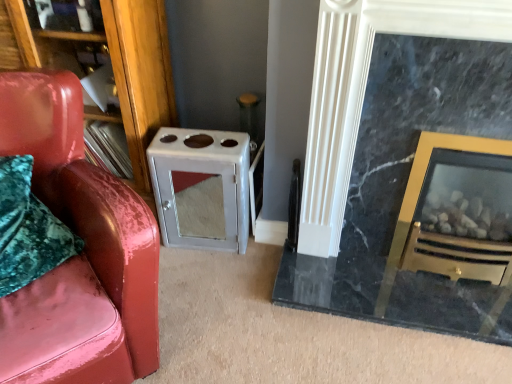
Question: Can you confirm if satin silver cabinet at center is positioned to the right of glossy leather chair at left?

Choices:
 (A) no
 (B) yes

Answer: (B)

Question: Does satin silver cabinet at center appear on the left side of glossy leather chair at left?

Choices:
 (A) yes
 (B) no

Answer: (B)

Question: Is the position of satin silver cabinet at center more distant than that of glossy leather chair at left?

Choices:
 (A) yes
 (B) no

Answer: (A)

Question: Could you tell me if satin silver cabinet at center is turned towards glossy leather chair at left?

Choices:
 (A) yes
 (B) no

Answer: (A)

Question: Is satin silver cabinet at center not inside glossy leather chair at left?

Choices:
 (A) yes
 (B) no

Answer: (A)

Question: From the image's perspective, is satin silver cabinet at center located above or below glossy leather chair at left?

Choices:
 (A) above
 (B) below

Answer: (A)

Question: From a real-world perspective, is satin silver cabinet at center physically located above or below glossy leather chair at left?

Choices:
 (A) above
 (B) below

Answer: (B)

Question: Is satin silver cabinet at center situated inside glossy leather chair at left or outside?

Choices:
 (A) outside
 (B) inside

Answer: (A)

Question: Is satin silver cabinet at center in front of or behind glossy leather chair at left in the image?

Choices:
 (A) behind
 (B) front

Answer: (A)

Question: Is black marble fireplace at right bigger or smaller than wooden bookshelf at left?

Choices:
 (A) small
 (B) big

Answer: (B)

Question: Is point (342, 49) closer or farther from the camera than point (136, 132)?

Choices:
 (A) farther
 (B) closer

Answer: (B)

Question: From a real-world perspective, is black marble fireplace at right positioned above or below wooden bookshelf at left?

Choices:
 (A) above
 (B) below

Answer: (B)

Question: Considering the positions of black marble fireplace at right and wooden bookshelf at left in the image, is black marble fireplace at right taller or shorter than wooden bookshelf at left?

Choices:
 (A) short
 (B) tall

Answer: (B)

Question: From a real-world perspective, is black marble fireplace at right physically located above or below satin silver cabinet at center?

Choices:
 (A) below
 (B) above

Answer: (B)

Question: In the image, is black marble fireplace at right positioned in front of or behind satin silver cabinet at center?

Choices:
 (A) behind
 (B) front

Answer: (B)